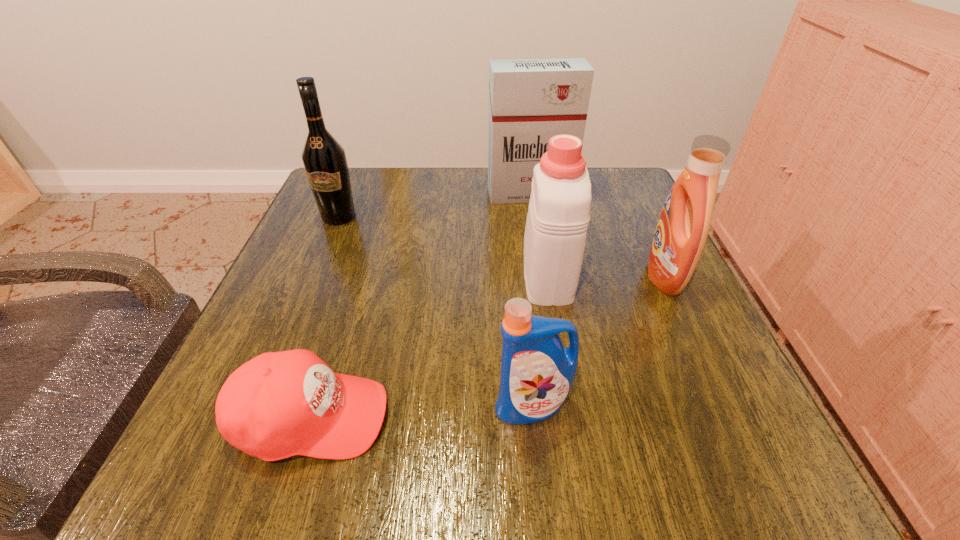
You are a GUI agent. You are given a task and a screenshot of the screen. Output one action in this format:
    pyautogui.click(x=<x>, y=<y>)
    Task: Click on the object that is at the near left corner
    The height and width of the screenshot is (540, 960).
    Given the screenshot: What is the action you would take?
    pyautogui.click(x=279, y=404)

Find the location of `free region at the far edge of the desktop`. free region at the far edge of the desktop is located at coordinates (477, 201).

You are a GUI agent. You are given a task and a screenshot of the screen. Output one action in this format:
    pyautogui.click(x=<x>, y=<y>)
    Task: Click on the vacant space at the near edge of the desktop
    
    Given the screenshot: What is the action you would take?
    pyautogui.click(x=575, y=468)

You are a GUI agent. You are given a task and a screenshot of the screen. Output one action in this format:
    pyautogui.click(x=<x>, y=<y>)
    Task: Click on the free region at the left edge of the desktop
    This screenshot has width=960, height=540.
    Given the screenshot: What is the action you would take?
    [x=280, y=308]

Find the location of a particular element. This screenshot has width=960, height=540. vacant space at the right edge is located at coordinates (686, 302).

Image resolution: width=960 pixels, height=540 pixels. Find the location of `blank space at the far left corner of the desktop`. blank space at the far left corner of the desktop is located at coordinates (367, 193).

Where is `blank area at the far right corner`? This screenshot has width=960, height=540. blank area at the far right corner is located at coordinates (640, 195).

Find the location of a particular element. This screenshot has height=540, width=960. blank space at the near right corner of the desktop is located at coordinates (729, 433).

You are a GUI agent. You are given a task and a screenshot of the screen. Output one action in this format:
    pyautogui.click(x=<x>, y=<y>)
    Task: Click on the free space between the farthest object and the shortest object
    The height and width of the screenshot is (540, 960).
    Given the screenshot: What is the action you would take?
    pyautogui.click(x=420, y=306)

Identify the location of vacant area that lies between the second shortest object and the rightmost object. This screenshot has width=960, height=540. (598, 341).